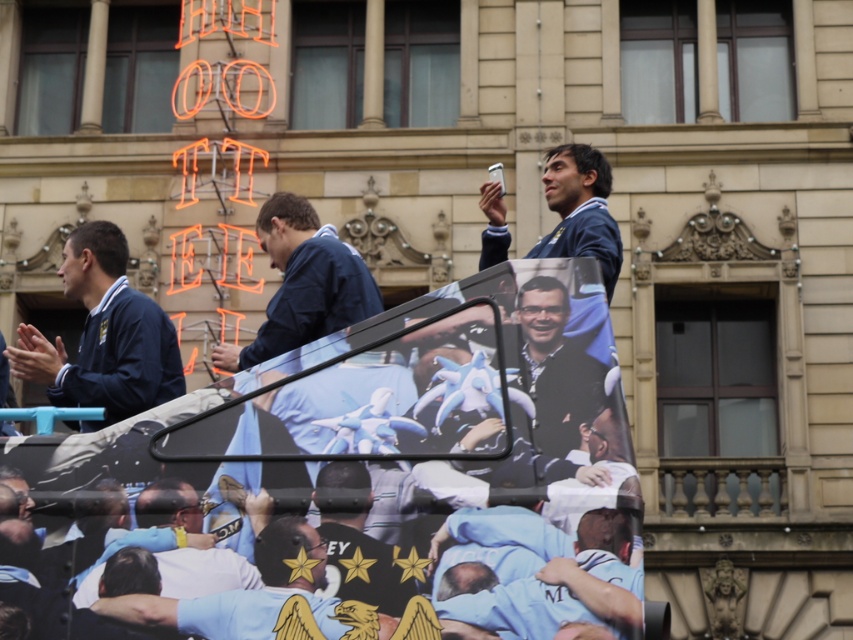
Question: Based on their relative distances, which object is farther from the blue fabric banner at center?

Choices:
 (A) dark blue shirt at center
 (B) blue fabric jacket at center
 (C) blue fabric jacket at upper center
 (D) matte blue jacket at left

Answer: (B)

Question: Is blue fabric banner at center above blue fabric jacket at center?

Choices:
 (A) no
 (B) yes

Answer: (A)

Question: Does blue fabric jacket at center have a larger size compared to dark blue shirt at center?

Choices:
 (A) no
 (B) yes

Answer: (B)

Question: Can you confirm if blue fabric banner at center is bigger than dark blue shirt at center?

Choices:
 (A) yes
 (B) no

Answer: (A)

Question: Which object is the closest to the blue fabric jacket at upper center?

Choices:
 (A) dark blue shirt at center
 (B) matte blue jacket at left

Answer: (A)

Question: Considering the real-world distances, which object is closest to the blue fabric banner at center?

Choices:
 (A) blue fabric jacket at center
 (B) matte blue jacket at left
 (C) blue fabric jacket at upper center
 (D) dark blue shirt at center

Answer: (D)